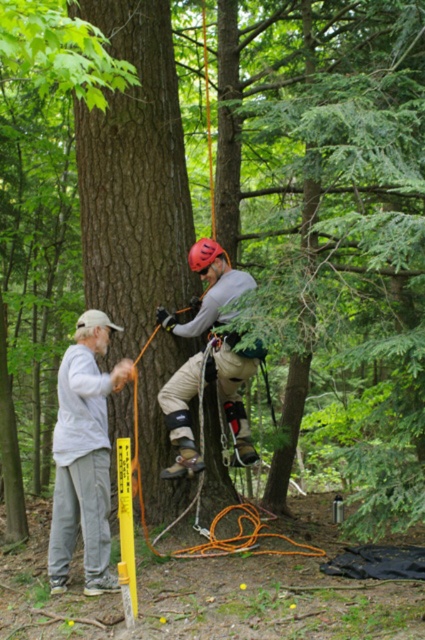
Where is the gray cotton shirt at left located in the image?

The gray cotton shirt at left is located at point 0.714 on the x axis and 0.198 on the y axis.

You are a hiker who wants to place a marker between the two points, point (91, 484) and point (166, 396). Which point is closer to you so you can start placing the marker from there?

Point (91, 484) is closer to the viewer than point (166, 396), so you should start placing the marker from point (91, 484).